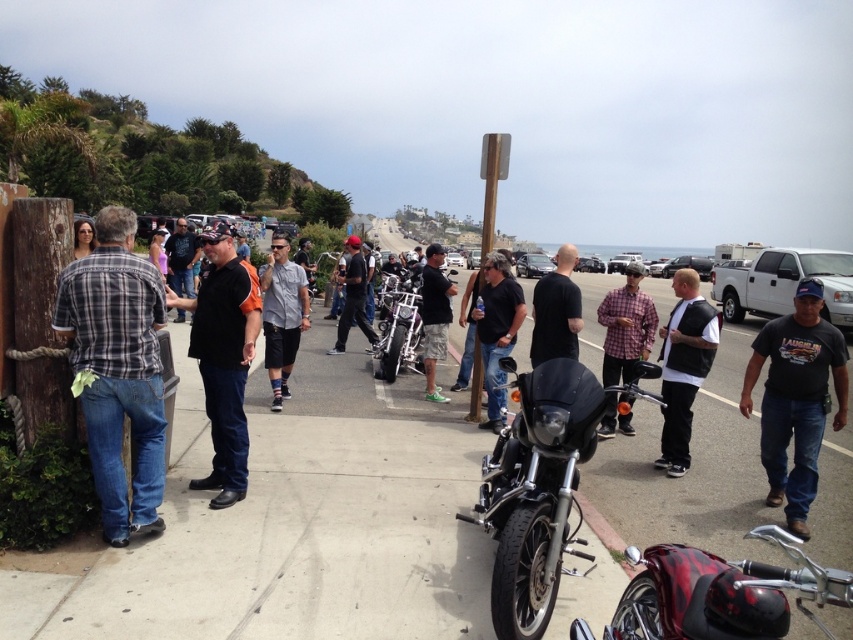
Does point (94, 360) come closer to viewer compared to point (741, 394)?

That is True.

Can you confirm if plaid shirt at left is bigger than dark gray t-shirt at center-right?

Incorrect, plaid shirt at left is not larger than dark gray t-shirt at center-right.

You are a GUI agent. You are given a task and a screenshot of the screen. Output one action in this format:
    pyautogui.click(x=<x>, y=<y>)
    Task: Click on the plaid shirt at left
    
    Given the screenshot: What is the action you would take?
    pyautogui.click(x=117, y=369)

Is polished chrome motorcycle at center positioned behind matte black hair at center?

Yes, it is.

Describe the element at coordinates (399, 330) in the screenshot. The height and width of the screenshot is (640, 853). I see `polished chrome motorcycle at center` at that location.

Find the location of a particular element. The width and height of the screenshot is (853, 640). polished chrome motorcycle at center is located at coordinates (399, 330).

Between plaid shirt at left and black smooth shirt at center, which one appears on the left side from the viewer's perspective?

black smooth shirt at center is more to the left.

Is point (71, 292) less distant than point (225, 467)?

Yes, it is in front of point (225, 467).

Measure the distance between plaid shirt at left and camera.

plaid shirt at left and camera are 12.74 feet apart from each other.

Where is `plaid shirt at left`? plaid shirt at left is located at coordinates (117, 369).